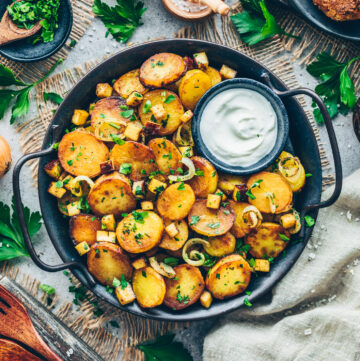
Find the location of a particular element. The image size is (360, 361). dish towel is located at coordinates (301, 286), (263, 340).